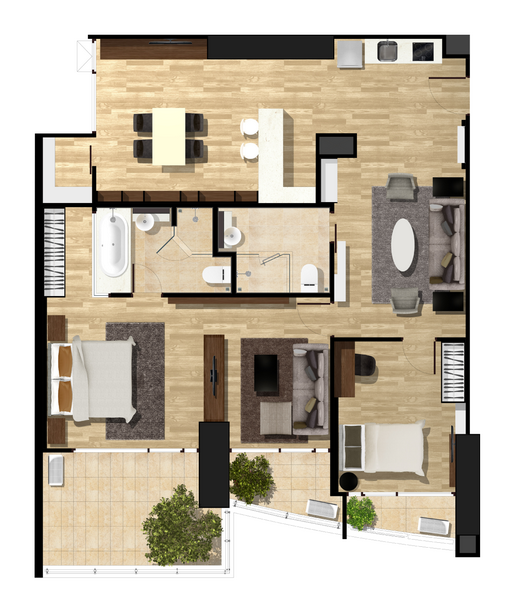
Where is `bed`? The width and height of the screenshot is (515, 596). bed is located at coordinates (123, 389).